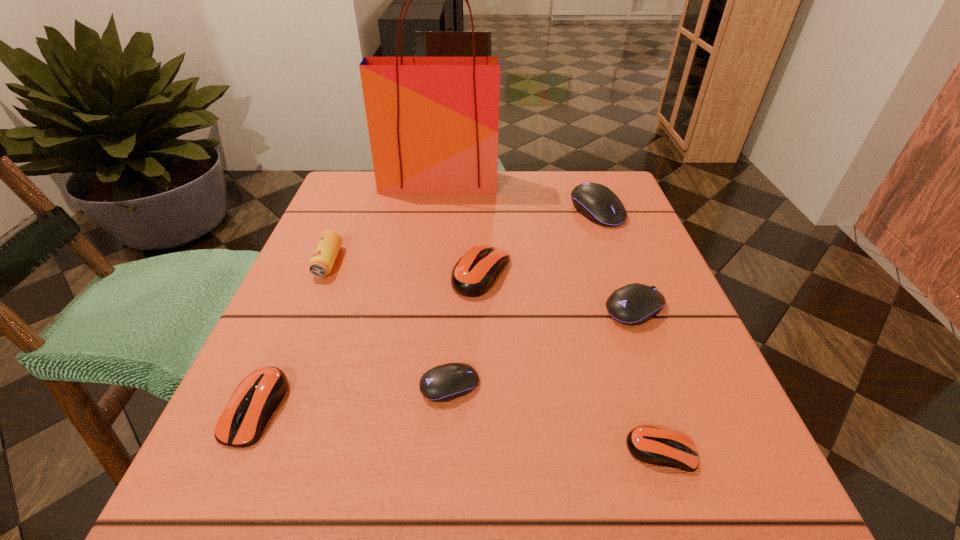
Locate an element on the screen. This screenshot has height=540, width=960. black computer mouse that is the second nearest to the beer can is located at coordinates (596, 202).

Select which black computer mouse appears as the closest to the smallest black computer mouse. Please provide its 2D coordinates. Your answer should be formatted as a tuple, i.e. [(x, y)], where the tuple contains the x and y coordinates of a point satisfying the conditions above.

[(634, 304)]

At what (x,y) coordinates should I click in order to perform the action: click on orange computer mouse that is the closest to the beer can. Please return your answer as a coordinate pair (x, y). Looking at the image, I should click on (255, 399).

This screenshot has height=540, width=960. I want to click on orange computer mouse that can be found as the closest to the second farthest black computer mouse, so click(x=473, y=275).

The width and height of the screenshot is (960, 540). What are the coordinates of `vacant position in the image that satisfies the following two spatial constraints: 1. on the back side of the biggest orange computer mouse; 2. on the left side of the farthest black computer mouse` in the screenshot? It's located at (481, 211).

I want to click on free space that satisfies the following two spatial constraints: 1. on the back side of the leftmost computer mouse; 2. on the left side of the biggest orange computer mouse, so click(315, 273).